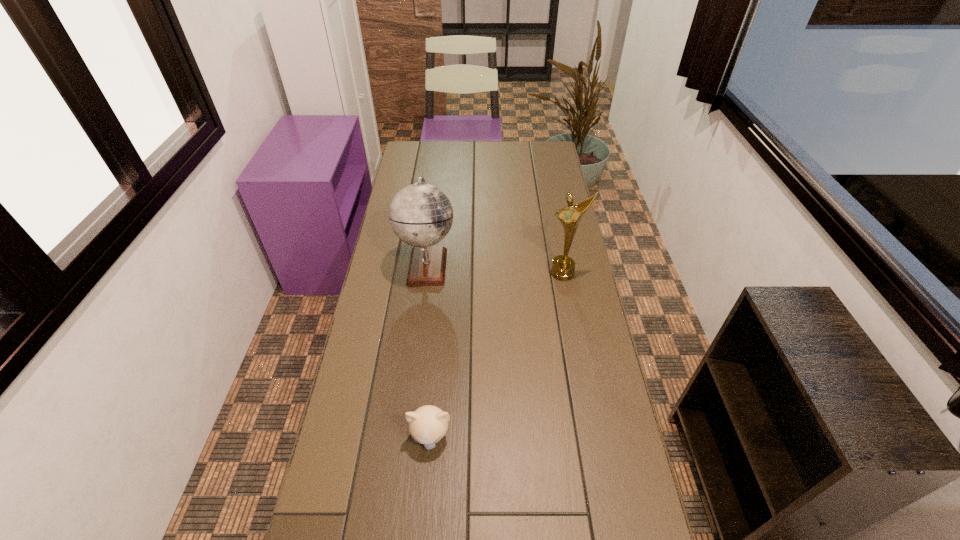
At what (x,y) coordinates should I click in order to perform the action: click on free location at the left edge of the desktop. Please return your answer as a coordinate pair (x, y). Looking at the image, I should click on (383, 251).

Locate an element on the screen. blank space at the right edge of the desktop is located at coordinates (626, 447).

Find the location of a particular element. The image size is (960, 540). free space at the far left corner of the desktop is located at coordinates (418, 143).

Find the location of a particular element. vacant area between the rightmost object and the kitten is located at coordinates (496, 355).

What are the coordinates of `free space between the globe and the rightmost object` in the screenshot? It's located at (495, 269).

You are a GUI agent. You are given a task and a screenshot of the screen. Output one action in this format:
    pyautogui.click(x=<x>, y=<y>)
    Task: Click on the empty location between the award and the shortest object
    The width and height of the screenshot is (960, 540).
    Given the screenshot: What is the action you would take?
    pyautogui.click(x=496, y=355)

Identify the location of free space between the rightmost object and the globe. (495, 269).

Choose which object is the nearest neighbor to the kitten. Please provide its 2D coordinates. Your answer should be formatted as a tuple, i.e. [(x, y)], where the tuple contains the x and y coordinates of a point satisfying the conditions above.

[(421, 215)]

Locate which object is the second closest to the nearest object. Please provide its 2D coordinates. Your answer should be formatted as a tuple, i.e. [(x, y)], where the tuple contains the x and y coordinates of a point satisfying the conditions above.

[(563, 266)]